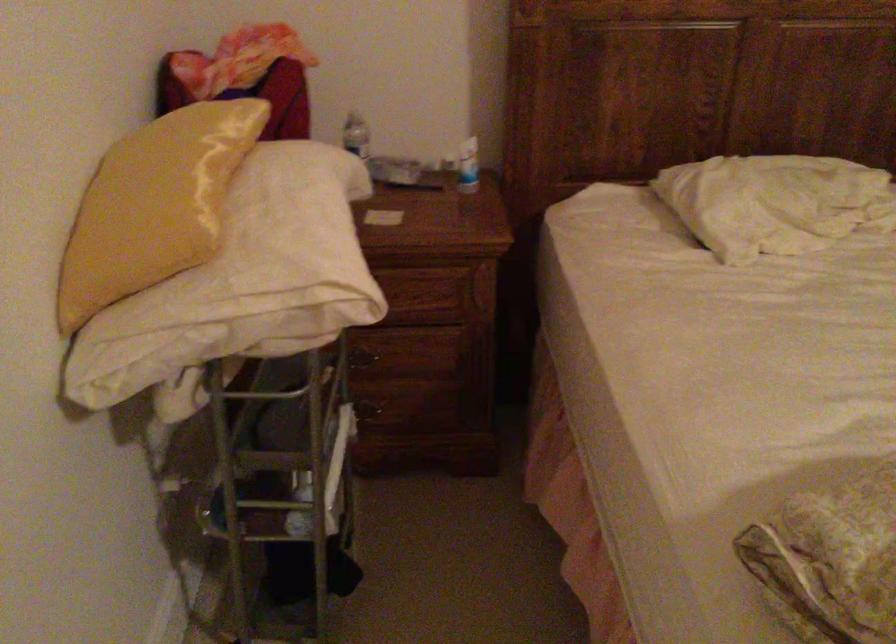
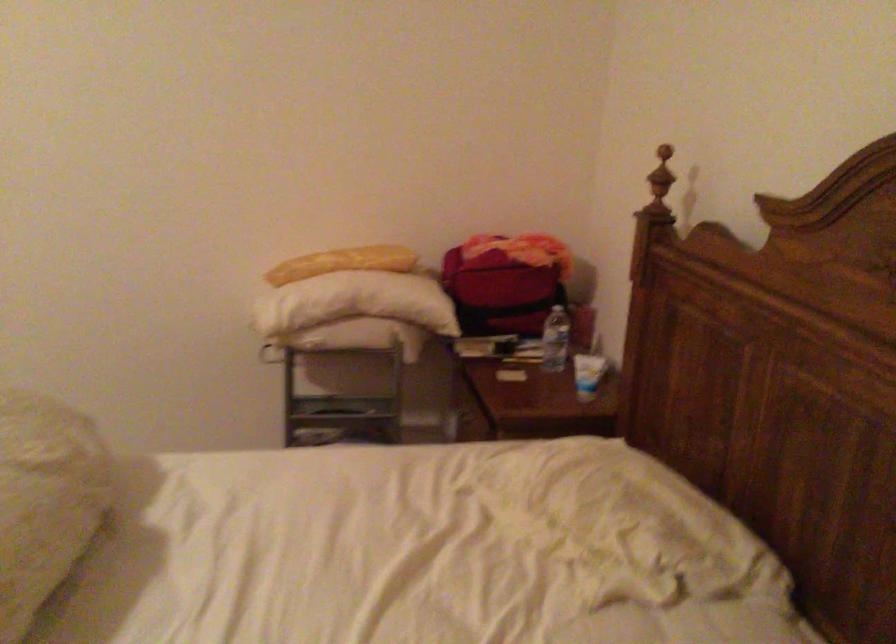
Question: I am providing you with two images of the same scene from different viewpoints. Please identify which objects are invisible in image2.

Choices:
 (A) red bag
 (B) black recessed handle
 (C) long yellow bread
 (D) white pillow

Answer: (D)